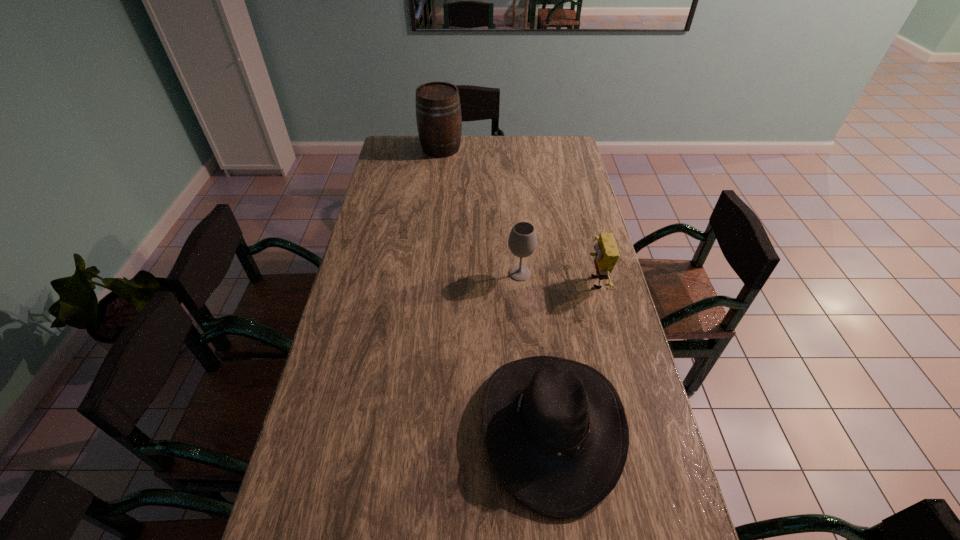
What are the coordinates of `vacant area situated 0.200m on the front-facing side of the cowboy hat` in the screenshot? It's located at (404, 427).

Identify the location of free space located on the front-facing side of the cowboy hat. (420, 427).

You are a GUI agent. You are given a task and a screenshot of the screen. Output one action in this format:
    pyautogui.click(x=<x>, y=<y>)
    Task: Click on the free point located 0.320m on the front-facing side of the cowboy hat
    
    Given the screenshot: What is the action you would take?
    pyautogui.click(x=358, y=427)

This screenshot has width=960, height=540. I want to click on object situated at the far edge, so click(438, 110).

The height and width of the screenshot is (540, 960). Find the location of `object at the left edge`. object at the left edge is located at coordinates (438, 110).

Locate an element on the screen. The image size is (960, 540). sponge at the right edge is located at coordinates (606, 256).

Where is `cowboy hat positioned at the right edge`? The image size is (960, 540). cowboy hat positioned at the right edge is located at coordinates (556, 431).

Find the location of a particular element. object that is at the far left corner is located at coordinates (438, 110).

At what (x,y) coordinates should I click in order to perform the action: click on vacant space at the far edge of the desktop. Please return your answer as a coordinate pair (x, y). This screenshot has width=960, height=540. Looking at the image, I should click on (531, 157).

Locate an element on the screen. This screenshot has height=540, width=960. vacant space at the left edge of the desktop is located at coordinates (367, 217).